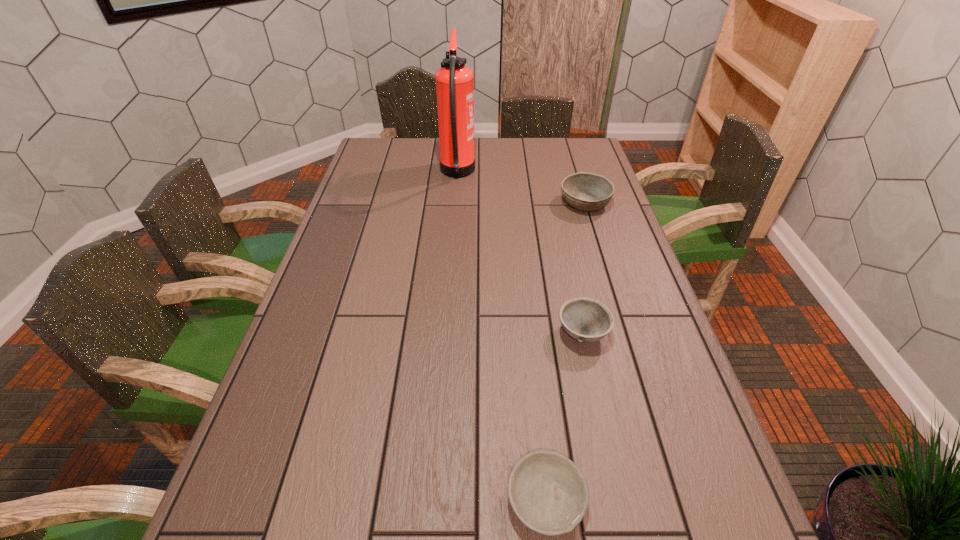
Locate which bowl ranks second in proximity to the farthest bowl. Please provide its 2D coordinates. Your answer should be formatted as a tuple, i.e. [(x, y)], where the tuple contains the x and y coordinates of a point satisfying the conditions above.

[(549, 494)]

Where is `bowl that is the closest one to the tallest object`? The image size is (960, 540). bowl that is the closest one to the tallest object is located at coordinates 588,192.

Locate an element on the screen. free space that satisfies the following two spatial constraints: 1. at the nozzle of the second nearest object; 2. on the left side of the leftmost object is located at coordinates (x=445, y=333).

The height and width of the screenshot is (540, 960). In order to click on free location that satisfies the following two spatial constraints: 1. at the nozzle of the farthest bowl; 2. on the left side of the tallest object in this screenshot , I will do `click(455, 204)`.

What are the coordinates of `vacant space that satisfies the following two spatial constraints: 1. at the nozzle of the second nearest bowl; 2. on the left side of the fire extinguisher` in the screenshot? It's located at (445, 333).

You are a GUI agent. You are given a task and a screenshot of the screen. Output one action in this format:
    pyautogui.click(x=<x>, y=<y>)
    Task: Click on the free space that satisfies the following two spatial constraints: 1. on the back side of the second farthest bowl; 2. on the left side of the farthest bowl
    
    Given the screenshot: What is the action you would take?
    pyautogui.click(x=554, y=204)